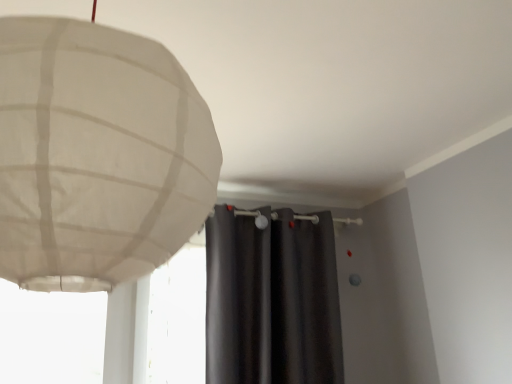
Question: Is white paper lampshade at upper left bigger or smaller than dark gray matte curtain at center?

Choices:
 (A) big
 (B) small

Answer: (B)

Question: Is white paper lampshade at upper left wider or thinner than dark gray matte curtain at center?

Choices:
 (A) thin
 (B) wide

Answer: (B)

Question: From a real-world perspective, is white paper lampshade at upper left physically located above or below dark gray matte curtain at center?

Choices:
 (A) above
 (B) below

Answer: (A)

Question: From the image's perspective, is dark gray matte curtain at center located above or below white paper lampshade at upper left?

Choices:
 (A) below
 (B) above

Answer: (A)

Question: Is dark gray matte curtain at center bigger or smaller than white paper lampshade at upper left?

Choices:
 (A) big
 (B) small

Answer: (A)

Question: Is dark gray matte curtain at center taller or shorter than white paper lampshade at upper left?

Choices:
 (A) tall
 (B) short

Answer: (A)

Question: Is dark gray matte curtain at center inside the boundaries of white paper lampshade at upper left, or outside?

Choices:
 (A) outside
 (B) inside

Answer: (A)